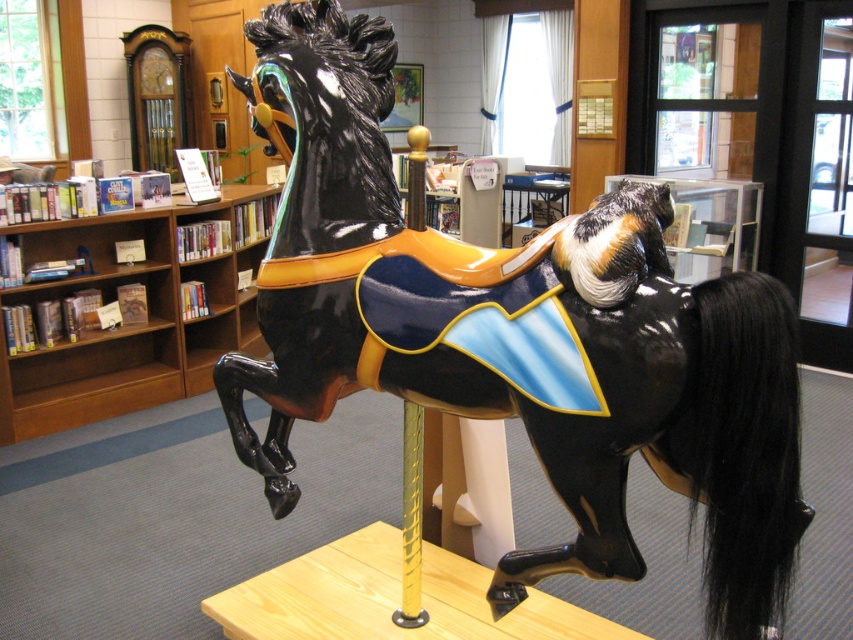
You are a librarian organizing a childrens reading event and want to place a storybook on the carousel horse. The storybook has a width of 15 cm. Can you determine if the glossy black horse at center will have enough space to accommodate the storybook?

The position of glossy black horse at center is at point (515, 336). However, this coordinate does not provide information about the available space on the horse to place the storybook. Therefore, it is unclear if the storybook will fit.